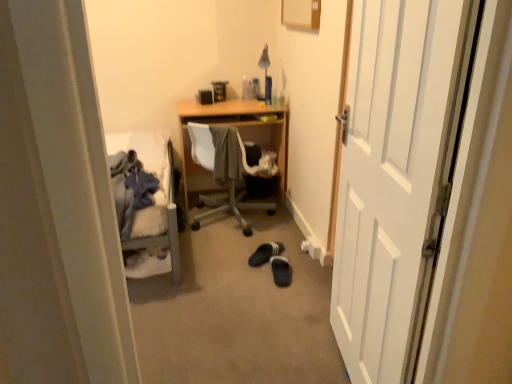
Question: From a real-world perspective, does white wooden door at right sit lower than gray fabric at center, which is counted as the 2th clothing, starting from the front?

Choices:
 (A) no
 (B) yes

Answer: (A)

Question: Considering the relative positions of white wooden door at right and gray fabric at center, which is the 1th clothing in back-to-front order, in the image provided, is white wooden door at right to the left of gray fabric at center, which is the 1th clothing in back-to-front order, from the viewer's perspective?

Choices:
 (A) no
 (B) yes

Answer: (A)

Question: Could you tell me if white wooden door at right is turned towards gray fabric at center, the 1th clothing viewed from the right?

Choices:
 (A) no
 (B) yes

Answer: (A)

Question: Is white wooden door at right oriented away from gray fabric at center, which ranks as the second clothing in left-to-right order?

Choices:
 (A) yes
 (B) no

Answer: (B)

Question: Can you confirm if white wooden door at right is taller than gray fabric at center, which is the 1th clothing in back-to-front order?

Choices:
 (A) yes
 (B) no

Answer: (A)

Question: Is white wooden door at right touching gray fabric at center, which is the 1th clothing in back-to-front order?

Choices:
 (A) yes
 (B) no

Answer: (B)

Question: Does denim jacket at left, marked as the 1th clothing in a left-to-right arrangement, appear on the right side of black suede slippers at center floor, positioned as the second footwear in back-to-front order?

Choices:
 (A) no
 (B) yes

Answer: (A)

Question: From the image's perspective, does denim jacket at left, the second clothing when ordered from back to front, appear higher than black suede slippers at center floor, positioned as the second footwear in back-to-front order?

Choices:
 (A) yes
 (B) no

Answer: (A)

Question: Would you consider denim jacket at left, the second clothing in the right-to-left sequence, to be distant from black suede slippers at center floor, positioned as the second footwear in back-to-front order?

Choices:
 (A) no
 (B) yes

Answer: (A)

Question: Can you confirm if denim jacket at left, marked as the 1th clothing in a left-to-right arrangement, is shorter than black suede slippers at center floor, arranged as the 1th footwear when viewed from the front?

Choices:
 (A) no
 (B) yes

Answer: (A)

Question: Considering the relative positions of denim jacket at left, the second clothing in the right-to-left sequence, and black suede slippers at center floor, arranged as the 1th footwear when viewed from the front, in the image provided, is denim jacket at left, the second clothing in the right-to-left sequence, behind black suede slippers at center floor, arranged as the 1th footwear when viewed from the front,?

Choices:
 (A) yes
 (B) no

Answer: (B)

Question: From the image's perspective, is denim jacket at left, the second clothing in the right-to-left sequence, located beneath black suede slippers at center floor, arranged as the 1th footwear when viewed from the front?

Choices:
 (A) yes
 (B) no

Answer: (B)

Question: Is white wooden door at right positioned far away from wooden chair at center?

Choices:
 (A) yes
 (B) no

Answer: (A)